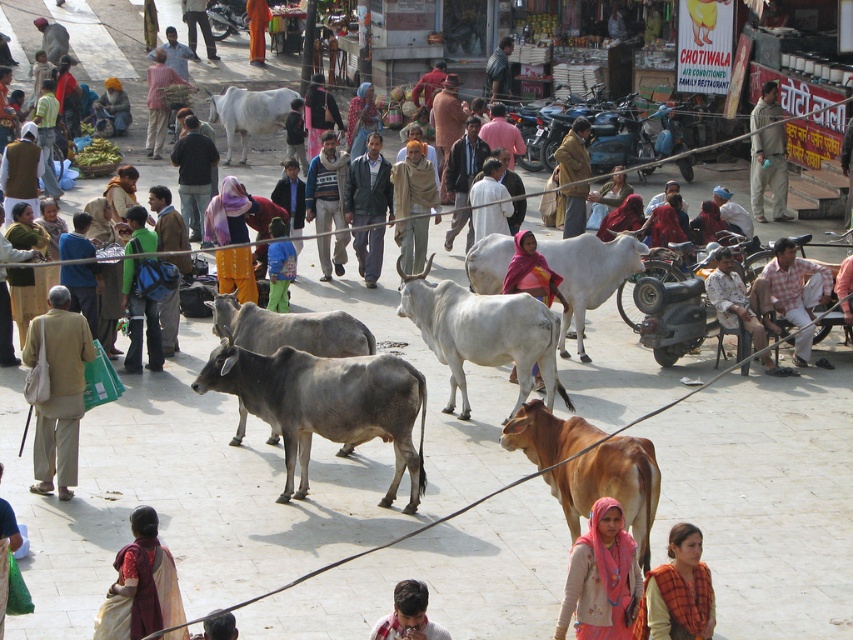
You are a tourist standing on the street and see the dark blue sweater at center and the white smooth cow at center. Which object is positioned more to the left?

The white smooth cow at center is positioned more to the left because the dark blue sweater at center is to the right of it.

You are a tourist in the market and see both the orange fabric scarf at center and the dark blue shirt at center. Which item is positioned more to the east side of the scene?

The orange fabric scarf at center is to the right of the dark blue shirt at center, so if the scene is oriented with right as east, the orange fabric scarf at center is more to the east.

You are a traveler in India who wants to buy a scarf and a shirt. You prefer items that are not too bulky. Based on the scene, which item between the orange fabric scarf at center and the dark blue shirt at center would you choose for a lighter, less bulky option?

The orange fabric scarf at center is thinner than the dark blue shirt at center, so the orange fabric scarf at center would be the lighter, less bulky option.